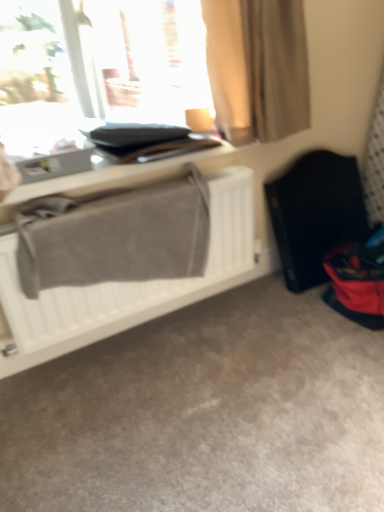
Question: Can you confirm if transparent glass window at upper left is positioned to the left of matte gray table at upper left?

Choices:
 (A) yes
 (B) no

Answer: (A)

Question: Would you say transparent glass window at upper left is outside matte gray table at upper left?

Choices:
 (A) yes
 (B) no

Answer: (A)

Question: Is transparent glass window at upper left facing towards matte gray table at upper left?

Choices:
 (A) no
 (B) yes

Answer: (B)

Question: Does transparent glass window at upper left appear on the right side of matte gray table at upper left?

Choices:
 (A) no
 (B) yes

Answer: (A)

Question: Is matte gray table at upper left inside transparent glass window at upper left?

Choices:
 (A) yes
 (B) no

Answer: (A)

Question: In terms of width, does transparent glass window at upper left look wider or thinner when compared to matte gray table at upper left?

Choices:
 (A) thin
 (B) wide

Answer: (B)

Question: Which is correct: transparent glass window at upper left is inside matte gray table at upper left, or outside of it?

Choices:
 (A) inside
 (B) outside

Answer: (B)

Question: Considering their positions, is transparent glass window at upper left located in front of or behind matte gray table at upper left?

Choices:
 (A) front
 (B) behind

Answer: (A)

Question: Based on their sizes in the image, would you say transparent glass window at upper left is bigger or smaller than matte gray table at upper left?

Choices:
 (A) big
 (B) small

Answer: (A)

Question: Based on their positions, is black fabric folding chair at right located to the left or right of beige fabric curtain at upper center?

Choices:
 (A) left
 (B) right

Answer: (B)

Question: Is point (327, 162) closer or farther from the camera than point (243, 40)?

Choices:
 (A) farther
 (B) closer

Answer: (A)

Question: Considering their positions, is black fabric folding chair at right located in front of or behind beige fabric curtain at upper center?

Choices:
 (A) front
 (B) behind

Answer: (B)

Question: Would you say black fabric folding chair at right is inside or outside beige fabric curtain at upper center?

Choices:
 (A) outside
 (B) inside

Answer: (A)

Question: Considering the positions of gray fabric at left and black fabric folding chair at right in the image, is gray fabric at left bigger or smaller than black fabric folding chair at right?

Choices:
 (A) small
 (B) big

Answer: (A)

Question: Would you say gray fabric at left is to the left or to the right of black fabric folding chair at right in the picture?

Choices:
 (A) right
 (B) left

Answer: (B)